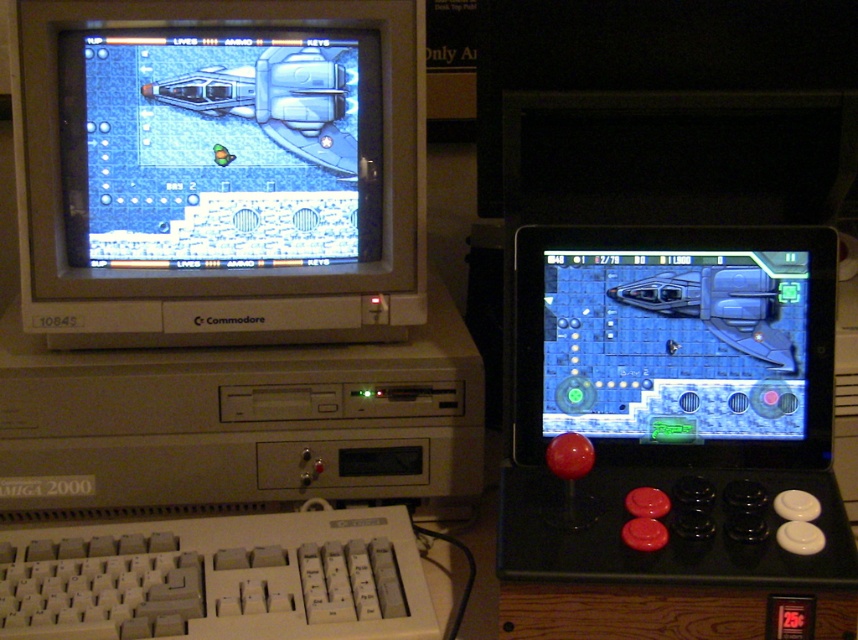
Question: Which object is farther from the camera taking this photo?

Choices:
 (A) matte gray monitor at center
 (B) metallic blue spaceship at center
 (C) white plastic keyboard at lower left

Answer: (A)

Question: Is matte gray monitor at center below metallic blue spaceship at center?

Choices:
 (A) no
 (B) yes

Answer: (A)

Question: Does white plastic keyboard at lower left lie behind metallic blue spaceship at center?

Choices:
 (A) yes
 (B) no

Answer: (B)

Question: Which object is the closest to the metallic blue spaceship at center?

Choices:
 (A) matte gray monitor at center
 (B) white plastic keyboard at lower left

Answer: (A)

Question: Can you confirm if white plastic keyboard at lower left is positioned below metallic blue spaceship at center?

Choices:
 (A) yes
 (B) no

Answer: (A)

Question: Which is farther from the matte gray monitor at center?

Choices:
 (A) metallic blue spaceship at center
 (B) white plastic keyboard at lower left

Answer: (B)